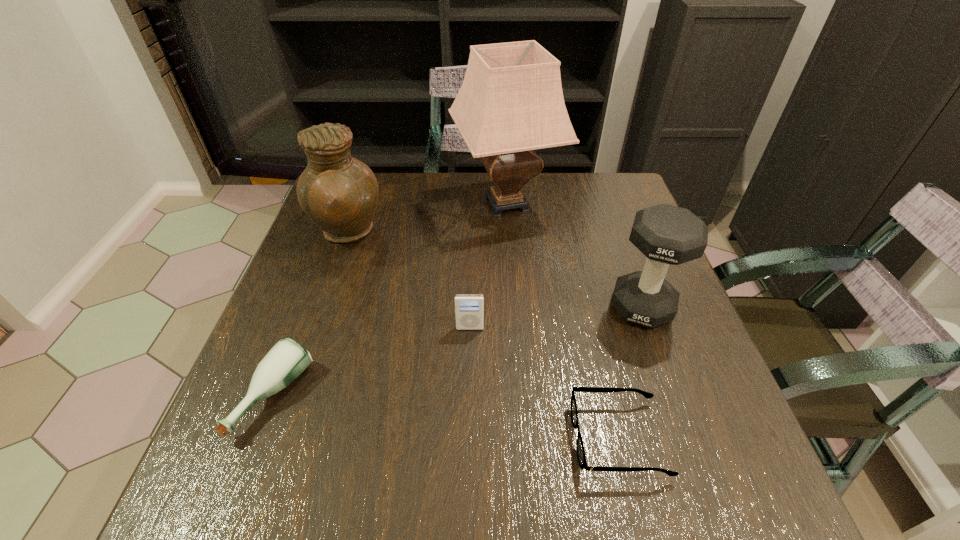
At what (x,y) coordinates should I click in order to perform the action: click on object identified as the closest to the lampshade. Please return your answer as a coordinate pair (x, y). This screenshot has height=540, width=960. Looking at the image, I should click on (339, 193).

Where is `free spot that satisfies the following two spatial constraints: 1. at the spout of the third tallest object; 2. on the left side of the pitcher`? The width and height of the screenshot is (960, 540). free spot that satisfies the following two spatial constraints: 1. at the spout of the third tallest object; 2. on the left side of the pitcher is located at coordinates (321, 307).

Identify the location of vacant area in the image that satisfies the following two spatial constraints: 1. at the spout of the pitcher; 2. on the front side of the second shortest object. (290, 397).